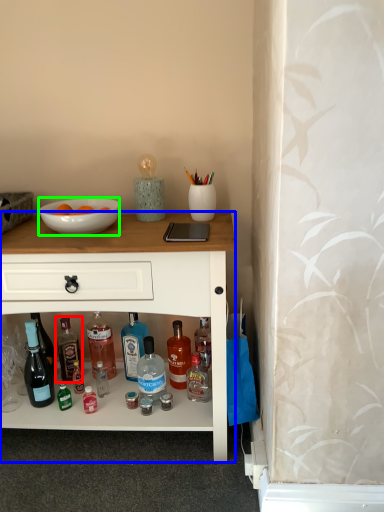
Question: Estimate the real-world distances between objects in this image. Which object is farther from bottle (highlighted by a red box), desk (highlighted by a blue box) or bowl (highlighted by a green box)?

Choices:
 (A) desk
 (B) bowl

Answer: (B)